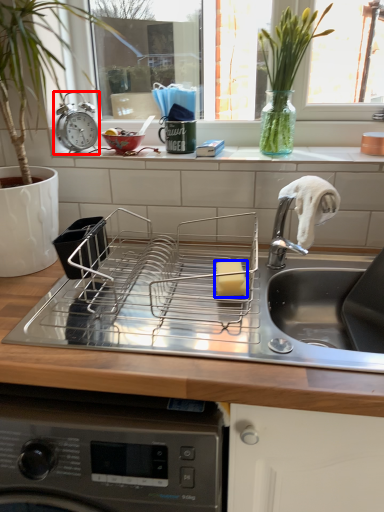
Question: Among these objects, which one is nearest to the camera, alarm clock (highlighted by a red box) or food (highlighted by a blue box)?

Choices:
 (A) alarm clock
 (B) food

Answer: (B)